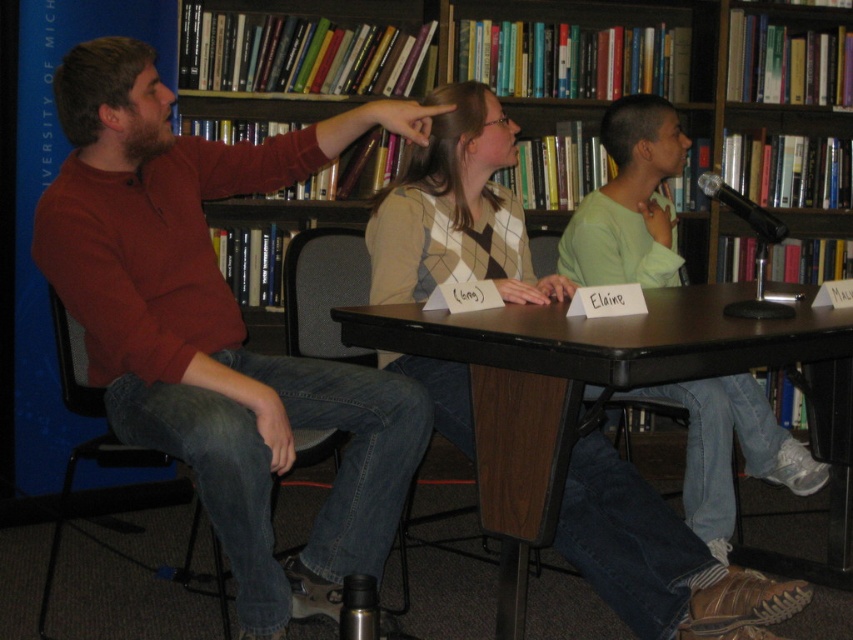
Question: Is wooden bookshelf at upper center to the left of brown wood table at center from the viewer's perspective?

Choices:
 (A) yes
 (B) no

Answer: (A)

Question: Which point is farther to the camera?

Choices:
 (A) (294, 461)
 (B) (531, 492)
 (C) (799, 460)
 (D) (843, 29)

Answer: (D)

Question: Does wooden bookshelf at upper center appear over brown wood table at center?

Choices:
 (A) yes
 (B) no

Answer: (A)

Question: Estimate the real-world distances between objects in this image. Which object is farther from the black plastic chair at left?

Choices:
 (A) matte red sweater at left
 (B) wooden bookshelf at upper center

Answer: (B)

Question: Is brown wood table at center thinner than black plastic chair at left?

Choices:
 (A) no
 (B) yes

Answer: (A)

Question: Which point is farther to the camera?

Choices:
 (A) wooden bookshelf at upper center
 (B) black plastic chair at left

Answer: (A)